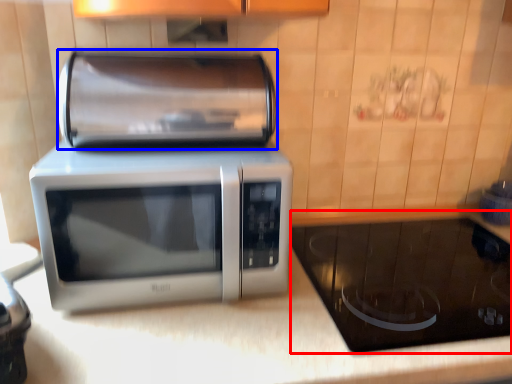
Question: Which object is further to the camera taking this photo, appliance (highlighted by a red box) or appliance (highlighted by a blue box)?

Choices:
 (A) appliance
 (B) appliance

Answer: (B)